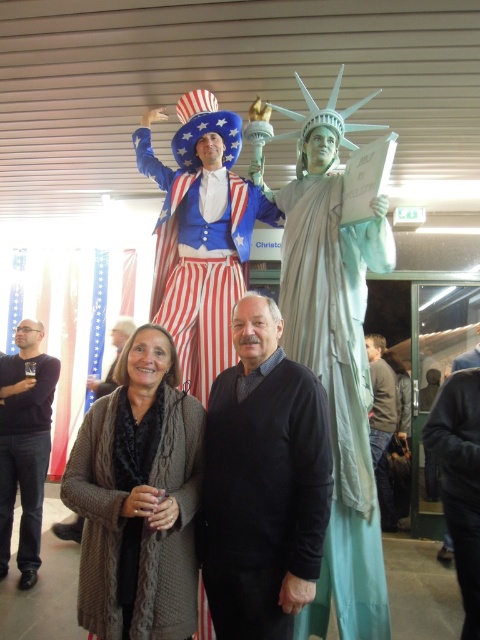
Between point (336, 205) and point (217, 344), which one is positioned in front?

Point (336, 205)

Between point (357, 580) and point (204, 390), which one is positioned in front?

Positioned in front is point (357, 580).

This screenshot has width=480, height=640. Find the location of `light blue fabric statue at center`. light blue fabric statue at center is located at coordinates (333, 349).

Measure the distance between knitted gray cardigan at center and smooth gray sweater at center.

They are 2.55 meters apart.

Describe the element at coordinates (139, 497) in the screenshot. I see `knitted gray cardigan at center` at that location.

Where is `knitted gray cardigan at center`? The width and height of the screenshot is (480, 640). knitted gray cardigan at center is located at coordinates (139, 497).

Does black velvet sweater at center come in front of dark gray sweater at right?

Yes, black velvet sweater at center is in front of dark gray sweater at right.

Between black velvet sweater at center and dark gray sweater at right, which one appears on the left side from the viewer's perspective?

From the viewer's perspective, black velvet sweater at center appears more on the left side.

I want to click on black velvet sweater at center, so click(263, 483).

Find the location of a particular element. The height and width of the screenshot is (640, 480). black velvet sweater at center is located at coordinates (263, 483).